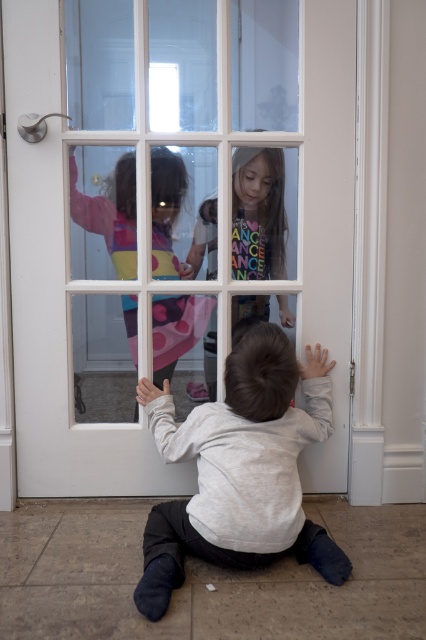
Consider the image. You are a photographer trying to capture the exact position of the gray cotton shirt at lower center in the image. According to the coordinates provided, where would you focus your camera to ensure the shirt is centered in the frame?

The gray cotton shirt at lower center is located at the 2D coordinates point (241,468), so focusing the camera there would center it in the frame.

You are a delivery person trying to reach the front door of the house. According to the image, where is the white glass door at center located in terms of coordinates?

The white glass door at center is located at coordinates point (170,218).

Consider the image. You are standing in front of the glass door and see two points marked on the glass. The first point is at coordinate point (x=89, y=177) and the second point is at coordinate point (x=167, y=509). Which point is closer to you?

Point (x=89, y=177) is closer to you because it is further to the viewer than point (x=167, y=509).